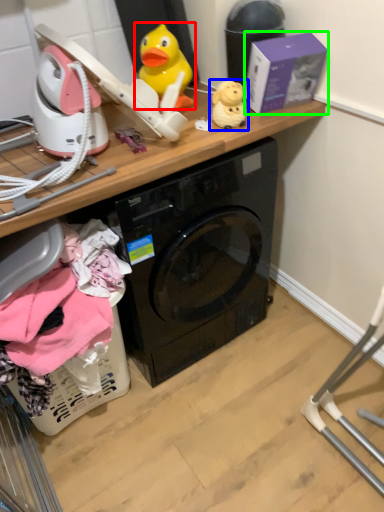
Question: Based on their relative distances, which object is nearer to toy (highlighted by a red box)? Choose from toy (highlighted by a blue box) and box (highlighted by a green box).

Choices:
 (A) toy
 (B) box

Answer: (A)